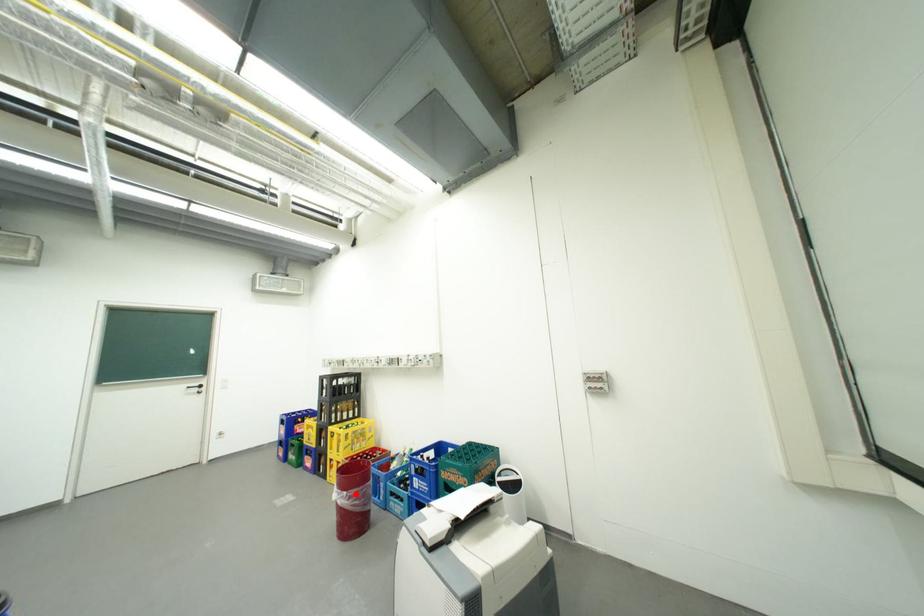
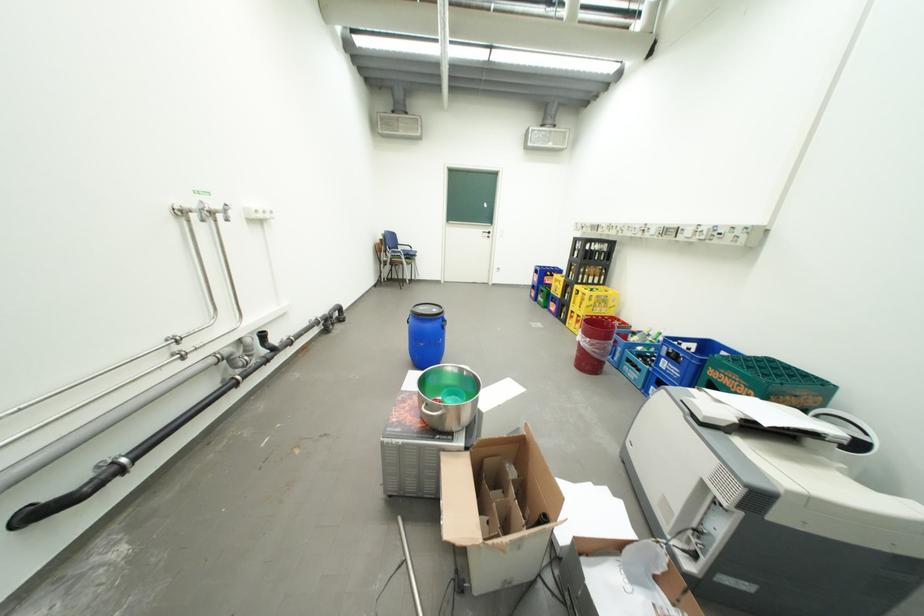
Where in the second image is the point corresponding to the highlighted location from the first image?

(599, 341)